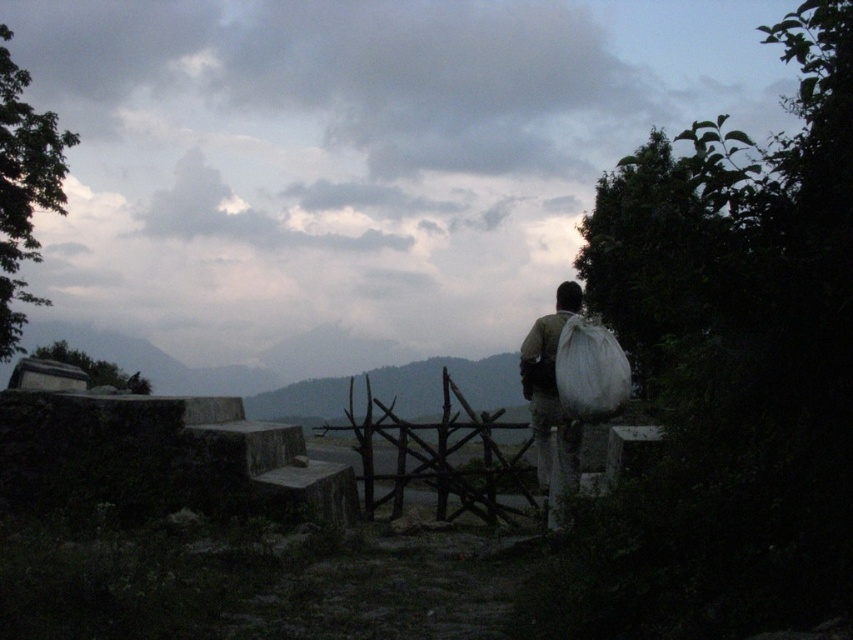
Locate an element on the screen. white fabric bag at center is located at coordinates (550, 403).

Is point (537, 422) positioned in front of point (584, 380)?

No, (537, 422) is further to viewer.

Is point (576, 436) positioned in front of point (561, 360)?

No, it is behind (561, 360).

At what (x,y) coordinates should I click in order to perform the action: click on white fabric bag at center. Please return your answer as a coordinate pair (x, y). The width and height of the screenshot is (853, 640). Looking at the image, I should click on (550, 403).